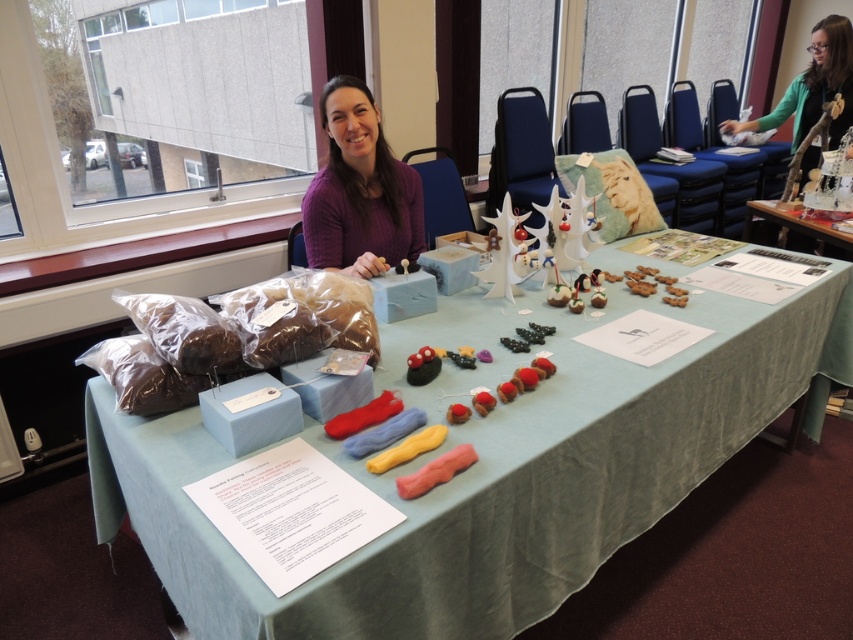
Who is higher up, purple soft sweater at center or yellow fabric at center?

purple soft sweater at center is higher up.

Can you confirm if purple soft sweater at center is smaller than yellow fabric at center?

No.

Is point (390, 241) positioned in front of point (432, 426)?

No, it is behind (432, 426).

The image size is (853, 640). I want to click on purple soft sweater at center, so click(358, 189).

Is point (309, 600) farther from viewer compared to point (364, 317)?

No, it is in front of (364, 317).

How distant is light blue fabric at center from brown matte plush at center?

A distance of 15.01 inches exists between light blue fabric at center and brown matte plush at center.

What do you see at coordinates (488, 468) in the screenshot? This screenshot has height=640, width=853. I see `light blue fabric at center` at bounding box center [488, 468].

The height and width of the screenshot is (640, 853). Identify the location of light blue fabric at center. (488, 468).

Between purple soft sweater at center and rubber-like pink candy at center, which one appears on the left side from the viewer's perspective?

purple soft sweater at center is more to the left.

Is purple soft sweater at center shorter than rubber-like pink candy at center?

No.

Locate an element on the screen. Image resolution: width=853 pixels, height=640 pixels. purple soft sweater at center is located at coordinates (358, 189).

Find the location of a particular element. This screenshot has height=640, width=853. purple soft sweater at center is located at coordinates (358, 189).